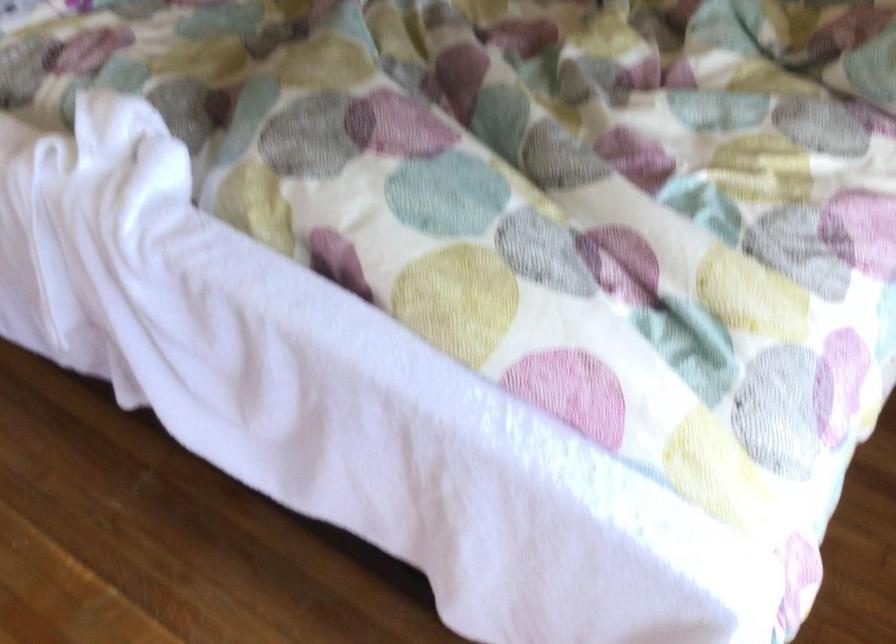
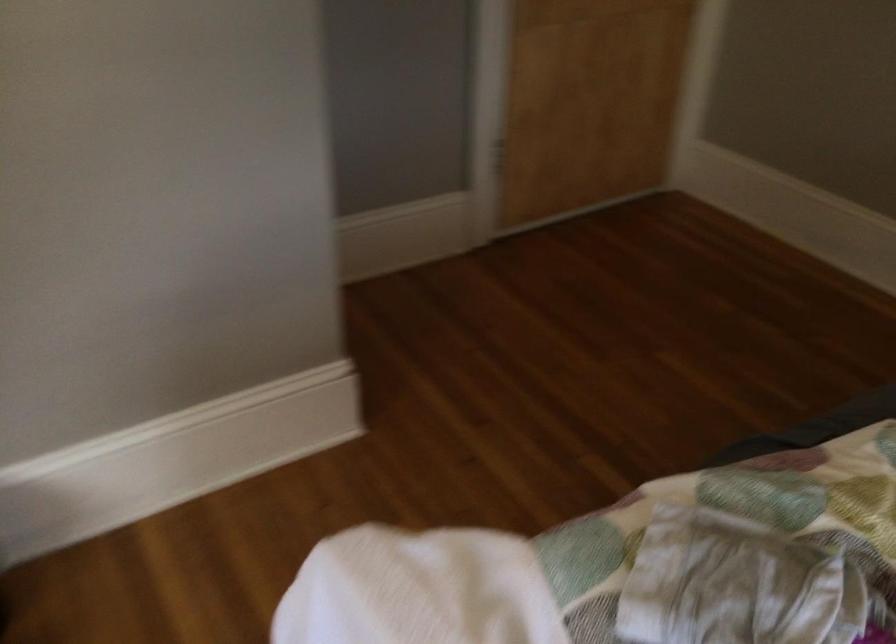
The images are taken continuously from a first-person perspective. In which direction are you moving?

The cameraman walked toward left, forward.